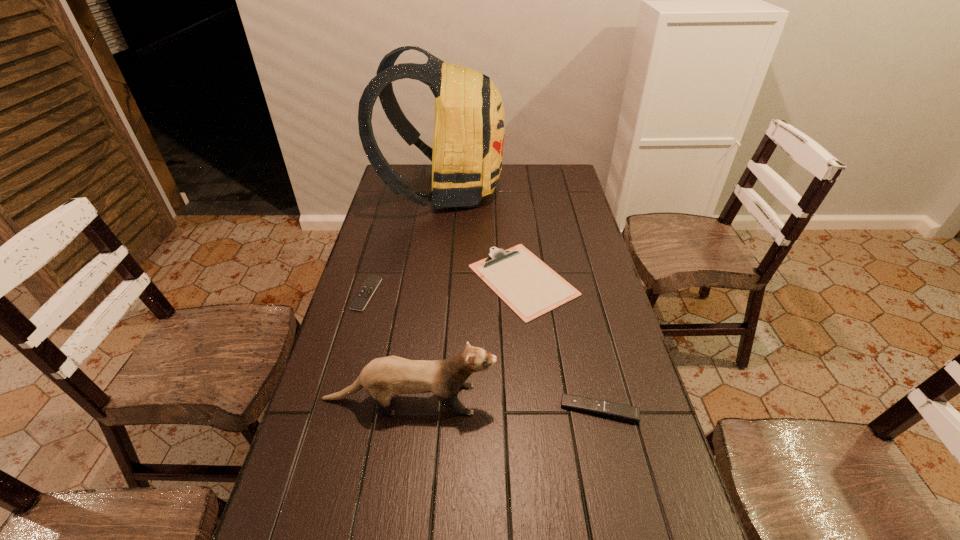
Find the location of a particular element. The image size is (960, 540). vacant space that is in between the ferret and the backpack is located at coordinates (426, 295).

Where is `unoccupied position between the fourth shortest object and the left remote control`? The width and height of the screenshot is (960, 540). unoccupied position between the fourth shortest object and the left remote control is located at coordinates (388, 346).

In order to click on vacant point located between the right remote control and the fourth shortest object in this screenshot , I will do `click(504, 404)`.

Where is `object that stands as the fourth closest to the tallest object`? The width and height of the screenshot is (960, 540). object that stands as the fourth closest to the tallest object is located at coordinates (618, 411).

Identify the location of object that is the fourth closest one to the farthest object. (618, 411).

Where is `vacant space that satisfies the following two spatial constraints: 1. on the back side of the taller remote control; 2. on the face of the ferret`? This screenshot has width=960, height=540. vacant space that satisfies the following two spatial constraints: 1. on the back side of the taller remote control; 2. on the face of the ferret is located at coordinates (597, 399).

The image size is (960, 540). I want to click on vacant space that satisfies the following two spatial constraints: 1. on the front side of the clipboard; 2. on the face of the second tallest object, so click(x=537, y=399).

Where is `free location that satisfies the following two spatial constraints: 1. on the front-facing side of the tallest object; 2. on the back side of the right remote control`? free location that satisfies the following two spatial constraints: 1. on the front-facing side of the tallest object; 2. on the back side of the right remote control is located at coordinates (415, 410).

You are a GUI agent. You are given a task and a screenshot of the screen. Output one action in this format:
    pyautogui.click(x=<x>, y=<y>)
    Task: Click on the blank space that satisfies the following two spatial constraints: 1. on the front-facing side of the farthest object; 2. on the back side of the nearer remote control
    This screenshot has height=540, width=960.
    Given the screenshot: What is the action you would take?
    pyautogui.click(x=415, y=410)

The image size is (960, 540). In order to click on vacant space that satisfies the following two spatial constraints: 1. on the front-facing side of the taller remote control; 2. on the left side of the tallest object in this screenshot , I will do `click(415, 410)`.